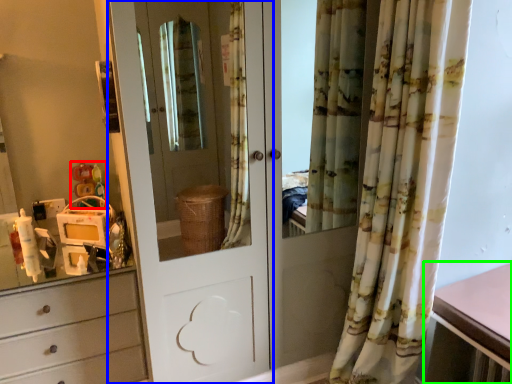
Question: Which object is positioned closest to toy (highlighted by a red box)? Select from door (highlighted by a blue box) and table (highlighted by a green box).

Choices:
 (A) door
 (B) table

Answer: (A)